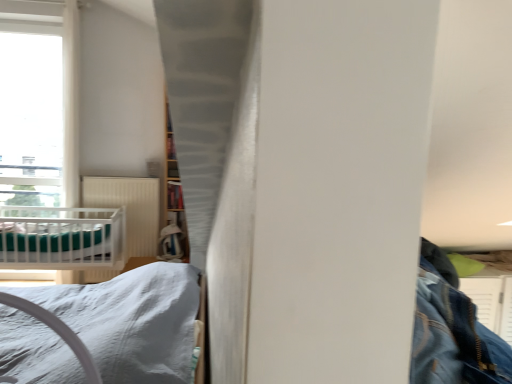
What do you see at coordinates (131, 321) in the screenshot? The image size is (512, 384). I see `white satin bed at lower left` at bounding box center [131, 321].

What is the approximate height of teal fabric sheet at left?

teal fabric sheet at left is 8.97 inches in height.

Where is `wooden bookshelf at center`? wooden bookshelf at center is located at coordinates (174, 195).

Is teal fabric sheet at left with white ribbed radiator at center?

They are not placed beside each other.

Visually, is teal fabric sheet at left positioned to the left or to the right of white ribbed radiator at center?

teal fabric sheet at left is positioned on white ribbed radiator at center's left side.

Is teal fabric sheet at left turned away from white ribbed radiator at center?

No.

From a real-world perspective, is wooden bookshelf at center above or below teal fabric sheet at left?

wooden bookshelf at center is situated higher than teal fabric sheet at left in the real world.

Considering the relative sizes of wooden bookshelf at center and teal fabric sheet at left in the image provided, is wooden bookshelf at center wider than teal fabric sheet at left?

In fact, wooden bookshelf at center might be narrower than teal fabric sheet at left.

Can you tell me how much wooden bookshelf at center and teal fabric sheet at left differ in facing direction?

The angle between the facing direction of wooden bookshelf at center and the facing direction of teal fabric sheet at left is 4.76 degrees.

Considering the relative sizes of wooden bookshelf at center and white satin bed at lower left in the image provided, is wooden bookshelf at center bigger than white satin bed at lower left?

Actually, wooden bookshelf at center might be smaller than white satin bed at lower left.

The image size is (512, 384). I want to click on shelf above the white satin bed at lower left (from the image's perspective), so click(174, 195).

Which is nearer, (83,247) or (168,200)?

The point (83,247) is in front.

Is teal fabric sheet at left far from wooden bookshelf at center?

They are positioned close to each other.

From a real-world perspective, is teal fabric sheet at left on top of wooden bookshelf at center?

Incorrect, from a real-world perspective, teal fabric sheet at left is lower than wooden bookshelf at center.

From the image's perspective, which one is positioned higher, teal fabric sheet at left or wooden bookshelf at center?

wooden bookshelf at center is shown above in the image.

Where is `sheet below the white satin bed at lower left (from a real-world perspective)`? sheet below the white satin bed at lower left (from a real-world perspective) is located at coordinates (47, 243).

Looking at their sizes, would you say white satin bed at lower left is wider or thinner than teal fabric sheet at left?

Clearly, white satin bed at lower left has less width compared to teal fabric sheet at left.

From a real-world perspective, does white satin bed at lower left stand above teal fabric sheet at left?

Indeed, from a real-world perspective, white satin bed at lower left stands above teal fabric sheet at left.

Measure the distance from white satin bed at lower left to teal fabric sheet at left.

white satin bed at lower left is 4.27 feet away from teal fabric sheet at left.

Considering the sizes of objects wooden bookshelf at center and white ribbed radiator at center in the image provided, who is bigger, wooden bookshelf at center or white ribbed radiator at center?

white ribbed radiator at center.

Is wooden bookshelf at center at the left side of white ribbed radiator at center?

Incorrect, wooden bookshelf at center is not on the left side of white ribbed radiator at center.

How many degrees apart are the facing directions of wooden bookshelf at center and white ribbed radiator at center?

3.94 degrees.

Could white ribbed radiator at center be considered to be inside wooden bookshelf at center?

No.

Is white ribbed radiator at center turned away from wooden bookshelf at center?

white ribbed radiator at center is not turned away from wooden bookshelf at center.

Between white ribbed radiator at center and wooden bookshelf at center, which one has more height?

white ribbed radiator at center is taller.

Measure the distance between white ribbed radiator at center and wooden bookshelf at center.

34.37 centimeters.

Considering the sizes of objects white ribbed radiator at center and wooden bookshelf at center in the image provided, who is bigger, white ribbed radiator at center or wooden bookshelf at center?

With larger size is white ribbed radiator at center.

Locate an element on the screen. The width and height of the screenshot is (512, 384). radiator above the teal fabric sheet at left (from a real-world perspective) is located at coordinates (129, 208).

Image resolution: width=512 pixels, height=384 pixels. In the image, there is a teal fabric sheet at left. Identify the location of shelf above it (from the image's perspective). (174, 195).

Estimate the real-world distances between objects in this image. Which object is further from white ribbed radiator at center, teal fabric sheet at left or wooden bookshelf at center?

teal fabric sheet at left is further to white ribbed radiator at center.

Considering their positions, is white ribbed radiator at center positioned closer to white satin bed at lower left than teal fabric sheet at left?

teal fabric sheet at left lies closer to white satin bed at lower left than the other object.

Estimate the real-world distances between objects in this image. Which object is further from teal fabric sheet at left, wooden bookshelf at center or white satin bed at lower left?

white satin bed at lower left.

Considering their positions, is white satin bed at lower left positioned closer to white ribbed radiator at center than teal fabric sheet at left?

Among the two, teal fabric sheet at left is located nearer to white ribbed radiator at center.

Based on their spatial positions, is white satin bed at lower left or white ribbed radiator at center further from wooden bookshelf at center?

white satin bed at lower left is positioned further to the anchor wooden bookshelf at center.

Looking at the image, which one is located closer to white satin bed at lower left, wooden bookshelf at center or teal fabric sheet at left?

teal fabric sheet at left is positioned closer to the anchor white satin bed at lower left.

Looking at the image, which one is located further to teal fabric sheet at left, white satin bed at lower left or white ribbed radiator at center?

Among the two, white satin bed at lower left is located further to teal fabric sheet at left.

When comparing their distances from teal fabric sheet at left, does wooden bookshelf at center or white ribbed radiator at center seem further?

The object further to teal fabric sheet at left is wooden bookshelf at center.

Identify the location of radiator between white satin bed at lower left and wooden bookshelf at center from front to back. The height and width of the screenshot is (384, 512). (129, 208).

Image resolution: width=512 pixels, height=384 pixels. Find the location of `radiator between teal fabric sheet at left and wooden bookshelf at center`. radiator between teal fabric sheet at left and wooden bookshelf at center is located at coordinates pyautogui.click(x=129, y=208).

Find the location of a particular element. The image size is (512, 384). sheet between white satin bed at lower left and wooden bookshelf at center in the front-back direction is located at coordinates point(47,243).

The height and width of the screenshot is (384, 512). Find the location of `sheet between white satin bed at lower left and white ribbed radiator at center along the z-axis`. sheet between white satin bed at lower left and white ribbed radiator at center along the z-axis is located at coordinates (47, 243).